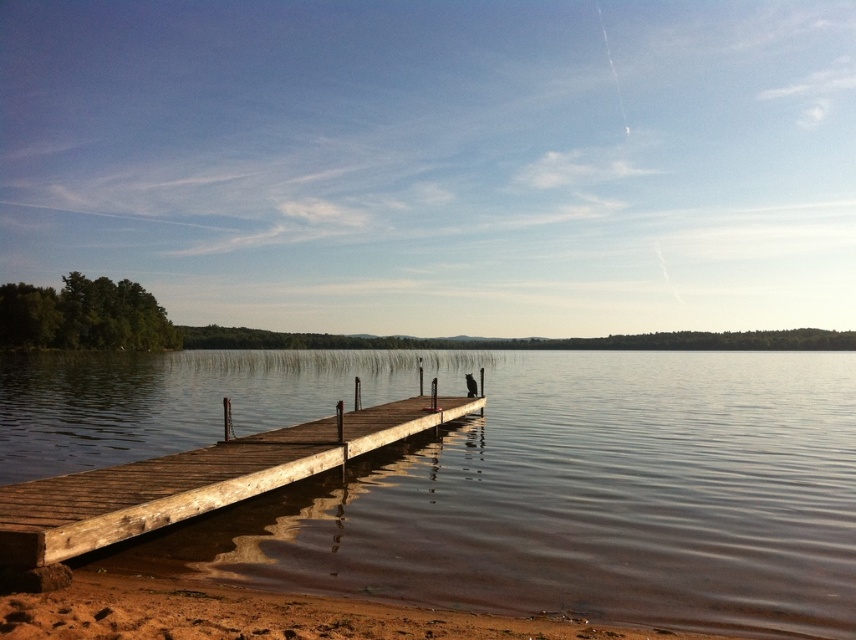
Does brown wooden water at center appear over wooden dock at center?

Actually, brown wooden water at center is below wooden dock at center.

Which is above, brown wooden water at center or wooden dock at center?

wooden dock at center

I want to click on brown wooden water at center, so click(x=581, y=497).

Measure the distance from brown wooden water at center to brown sandy beach at lower left.

brown wooden water at center is 39.63 meters away from brown sandy beach at lower left.

Is point (663, 413) closer to viewer compared to point (307, 634)?

No, it is not.

Between point (455, 474) and point (235, 614), which one is positioned in front?

Point (235, 614) is in front.

Image resolution: width=856 pixels, height=640 pixels. I want to click on brown wooden water at center, so click(581, 497).

Based on the photo, does wooden dock at center appear on the left side of brown sandy beach at lower left?

Yes, wooden dock at center is to the left of brown sandy beach at lower left.

Who is more forward, [437,401] or [12,608]?

Positioned in front is point [12,608].

The width and height of the screenshot is (856, 640). I want to click on wooden dock at center, so click(x=195, y=480).